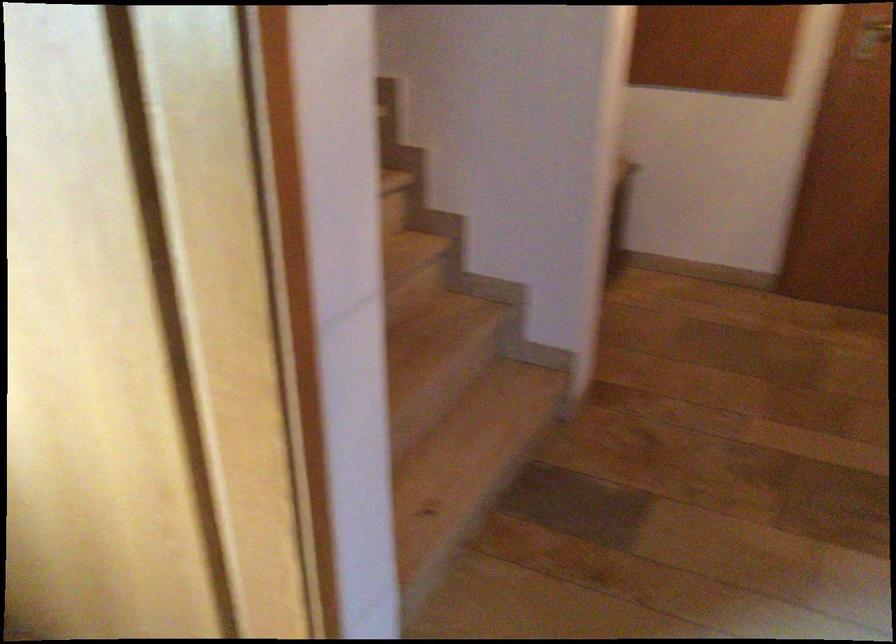
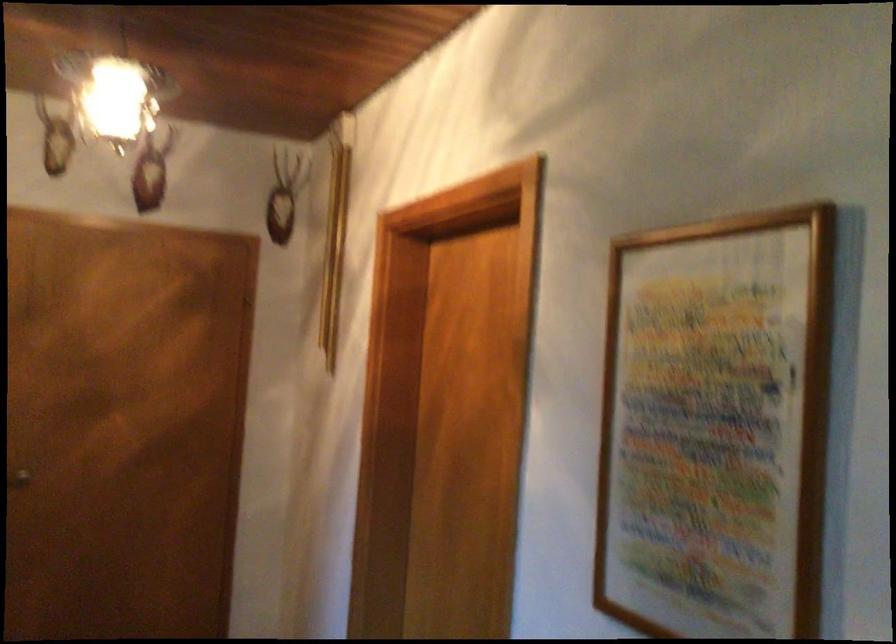
Based on the continuous images, in which direction is the camera rotating?

The camera rotated toward right-up.